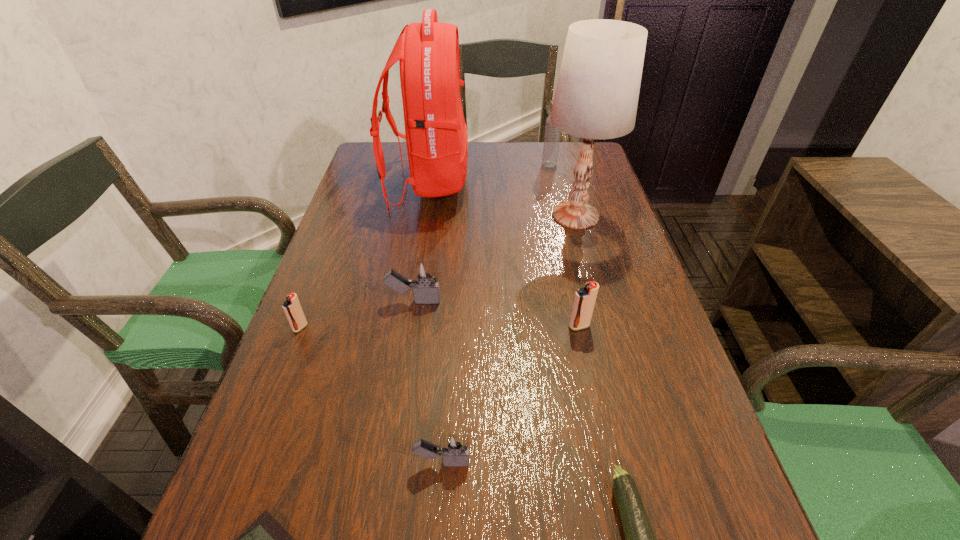
Find the location of `water bottle present at the far edge`. water bottle present at the far edge is located at coordinates (552, 135).

You are a GUI agent. You are given a task and a screenshot of the screen. Output one action in this format:
    pyautogui.click(x=<x>, y=<y>)
    Task: Click on the backpack that is positioned at the left edge
    Image resolution: width=960 pixels, height=540 pixels.
    Given the screenshot: What is the action you would take?
    pyautogui.click(x=436, y=136)

Identify the location of igniter located at the left edge. (292, 308).

In order to click on lamp present at the right edge in this screenshot , I will do `click(597, 92)`.

Image resolution: width=960 pixels, height=540 pixels. What are the coordinates of `water bottle present at the right edge` in the screenshot? It's located at (552, 135).

At what (x,y) coordinates should I click in order to perform the action: click on igniter present at the right edge. Please return your answer as a coordinate pair (x, y). Image resolution: width=960 pixels, height=540 pixels. Looking at the image, I should click on (584, 301).

The height and width of the screenshot is (540, 960). In order to click on object at the far left corner in this screenshot , I will do `click(436, 136)`.

Find the location of a particular element. object present at the far right corner is located at coordinates (552, 135).

Locate an element on the screen. This screenshot has width=960, height=540. vacant area at the far edge of the desktop is located at coordinates (517, 161).

In order to click on vacant space at the left edge of the desktop in this screenshot , I will do `click(328, 281)`.